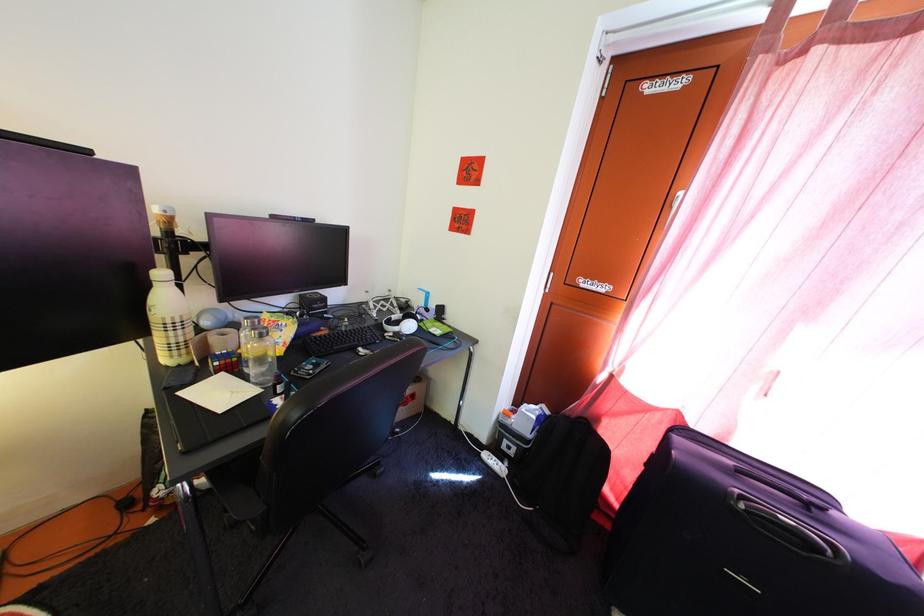
Find where to lift the plaid water bottle. Please return your answer as a coordinate pair (x, y).

(168, 318)